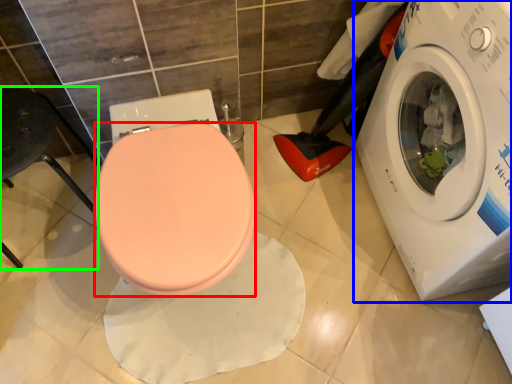
Question: Considering the real-world distances, which object is closest to bidet (highlighted by a red box)? washing machine (highlighted by a blue box) or chair (highlighted by a green box).

Choices:
 (A) washing machine
 (B) chair

Answer: (B)